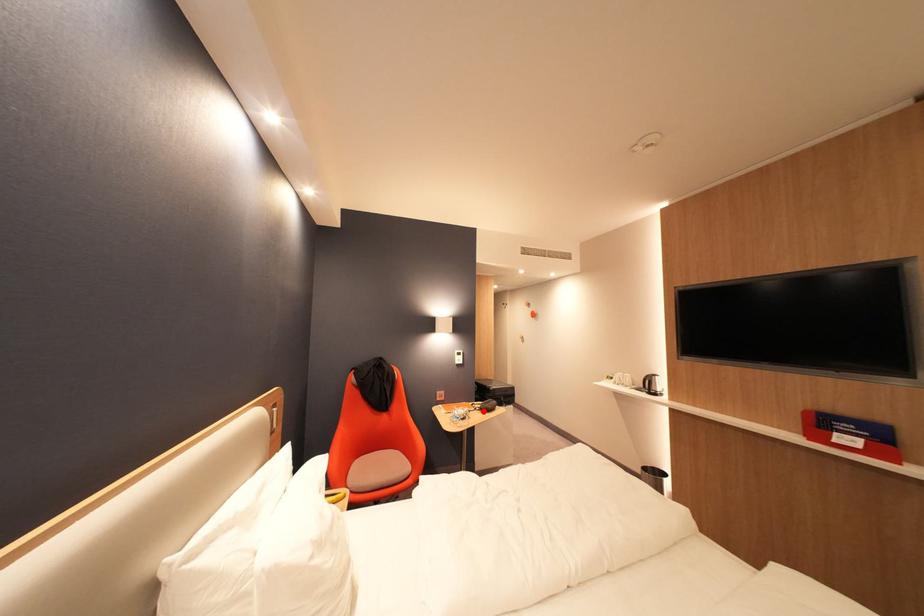
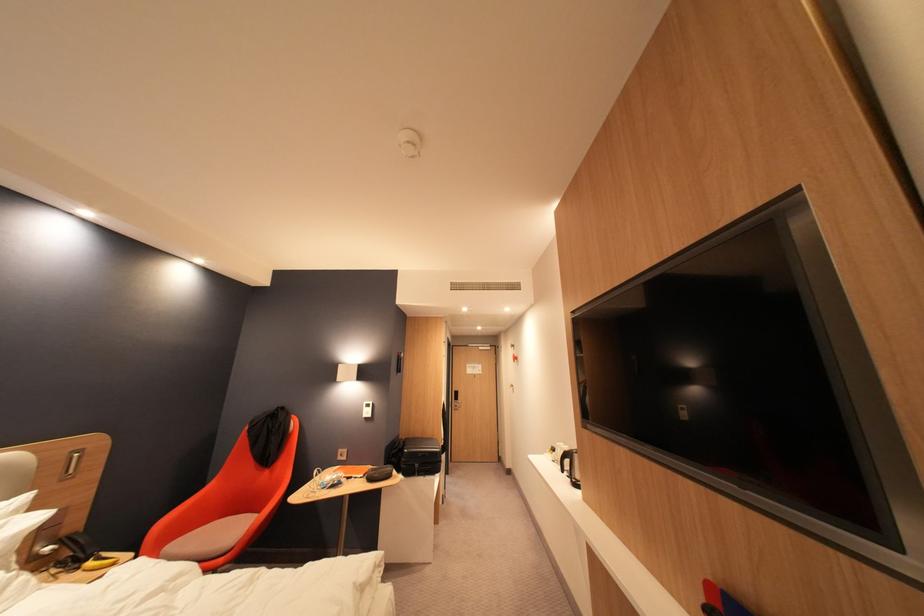
Locate, in the second image, the point that corresponds to the highlighted location in the first image.

(371, 477)